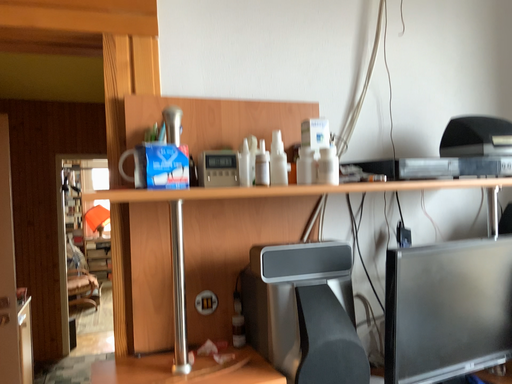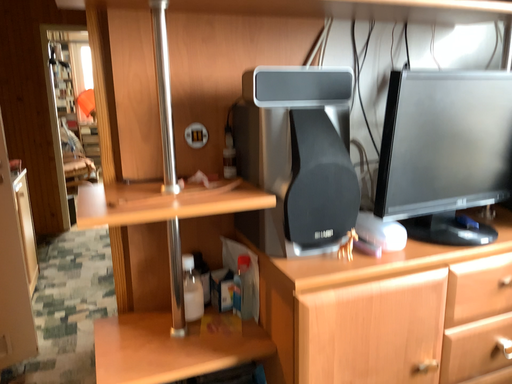
Question: Which way did the camera rotate in the video?

Choices:
 (A) rotated downward
 (B) rotated upward

Answer: (A)